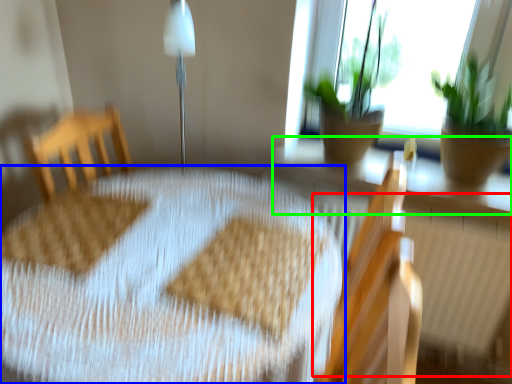
Question: Which is farther away from radiator (highlighted by a red box)? table (highlighted by a blue box) or window sill (highlighted by a green box)?

Choices:
 (A) table
 (B) window sill

Answer: (A)